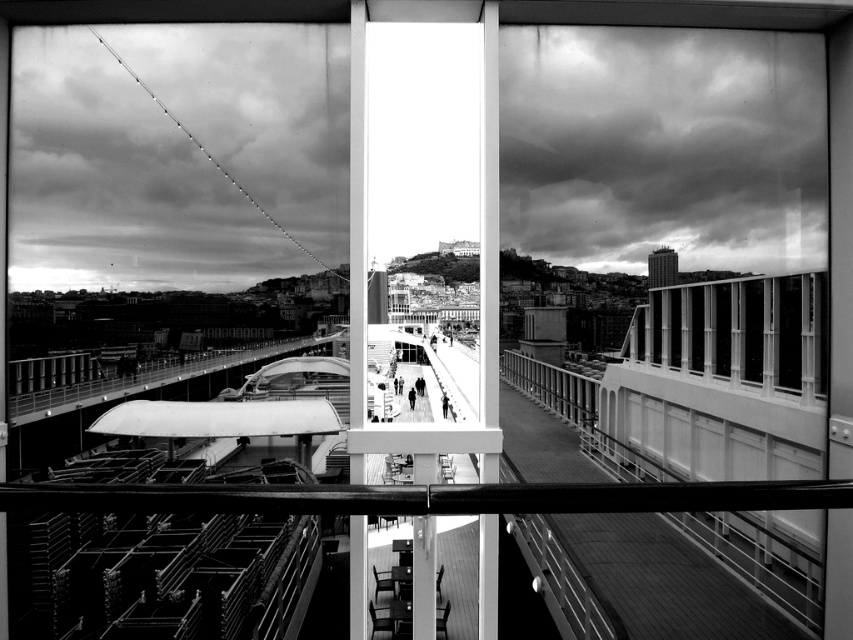
Question: Which point appears closest to the camera in this image?

Choices:
 (A) (410, 397)
 (B) (753, 371)

Answer: (B)

Question: From the image, what is the correct spatial relationship of metallic glass windows at right in relation to silhouette figure at center?

Choices:
 (A) above
 (B) below

Answer: (A)

Question: In this image, where is metallic glass windows at right located relative to silhouette figure at center?

Choices:
 (A) above
 (B) below

Answer: (A)

Question: Does metallic glass windows at right have a lesser width compared to silhouette figure at center?

Choices:
 (A) yes
 (B) no

Answer: (B)

Question: Which of the following is the closest to the observer?

Choices:
 (A) (412, 397)
 (B) (651, 364)

Answer: (B)